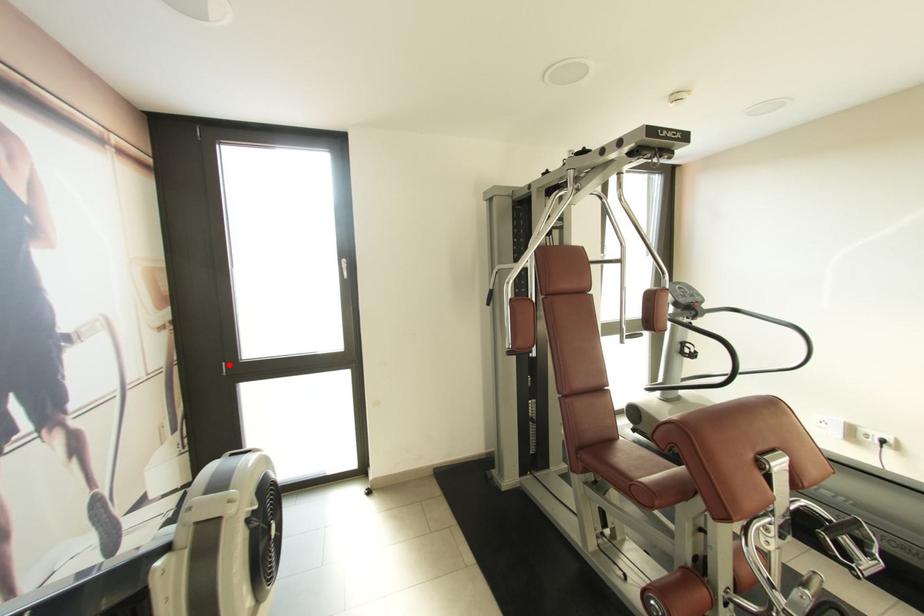
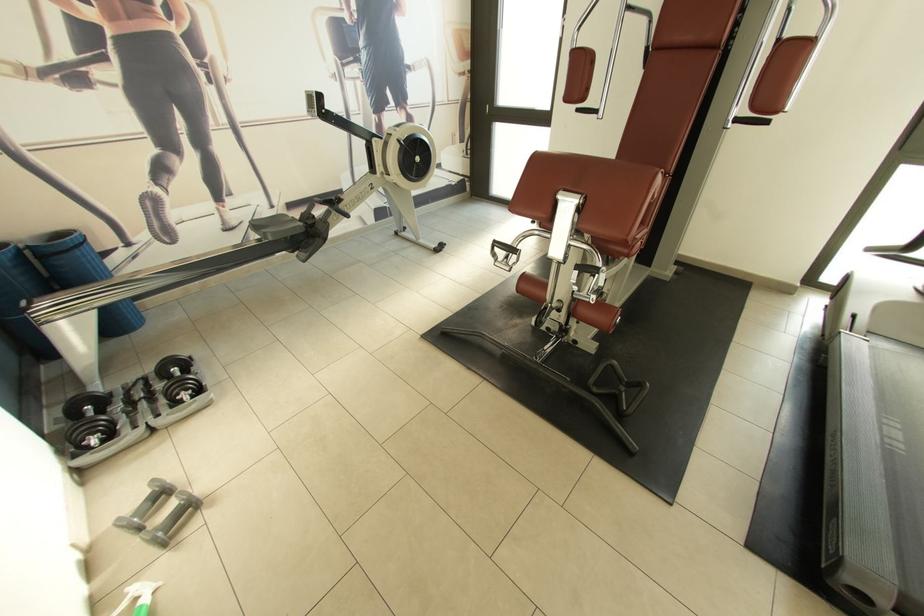
Question: I am providing you with two images of the same scene from different viewpoints. In image1, a red point is highlighted. Considering the same 3D point in image2, which of the following is correct?

Choices:
 (A) It is closer
 (B) It is farther

Answer: (A)